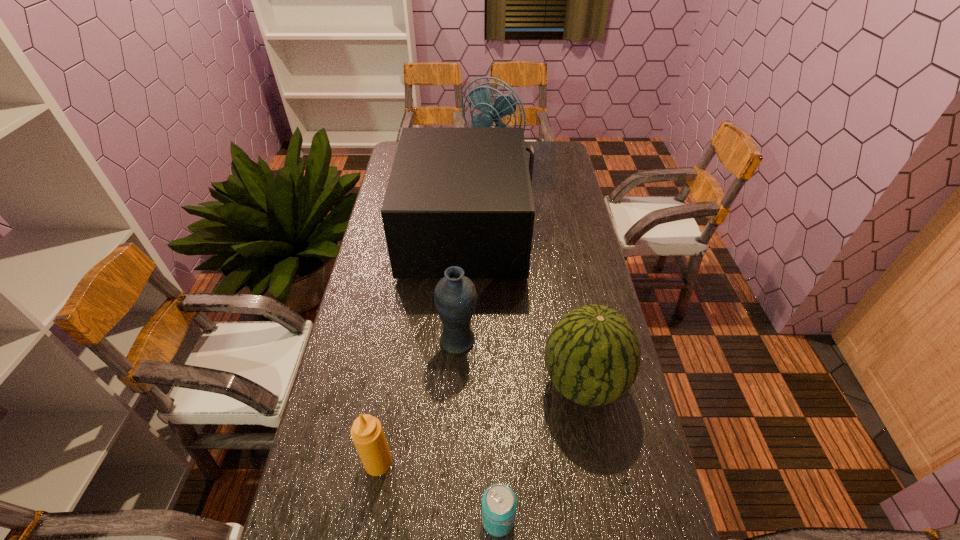
Where is `vacant region at the right edge of the desktop`? This screenshot has width=960, height=540. vacant region at the right edge of the desktop is located at coordinates (558, 196).

The height and width of the screenshot is (540, 960). In order to click on vacant space that's between the shortest object and the second nearest object in this screenshot , I will do `click(438, 491)`.

At what (x,y) coordinates should I click in order to perform the action: click on free spot between the nearest object and the watermelon. Please return your answer as a coordinate pair (x, y). Looking at the image, I should click on (540, 451).

This screenshot has height=540, width=960. Find the location of `unoccupied area between the watermelon and the microwave oven`. unoccupied area between the watermelon and the microwave oven is located at coordinates (525, 308).

Find the location of a particular element. The image size is (960, 540). free space between the second farthest object and the beer can is located at coordinates (483, 376).

What are the coordinates of `free point between the vase and the condiment` in the screenshot? It's located at (418, 402).

Identify the location of free point between the fifth nearest object and the watermelon. Image resolution: width=960 pixels, height=540 pixels. (525, 308).

The image size is (960, 540). What are the coordinates of `the second closest object to the vase` in the screenshot? It's located at (462, 197).

Identify the location of object that is the closest to the watermelon. (455, 297).

Identify the location of free spot that satisfies the following two spatial constraints: 1. on the back side of the watermelon; 2. on the front-facing side of the fifth nearest object. (555, 233).